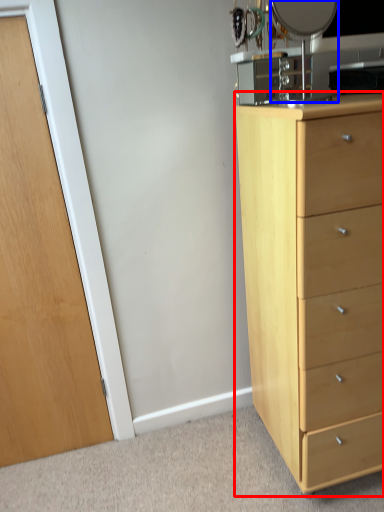
Question: Which object appears closest to the camera in this image, chest of drawers (highlighted by a red box) or mirror (highlighted by a blue box)?

Choices:
 (A) chest of drawers
 (B) mirror

Answer: (A)